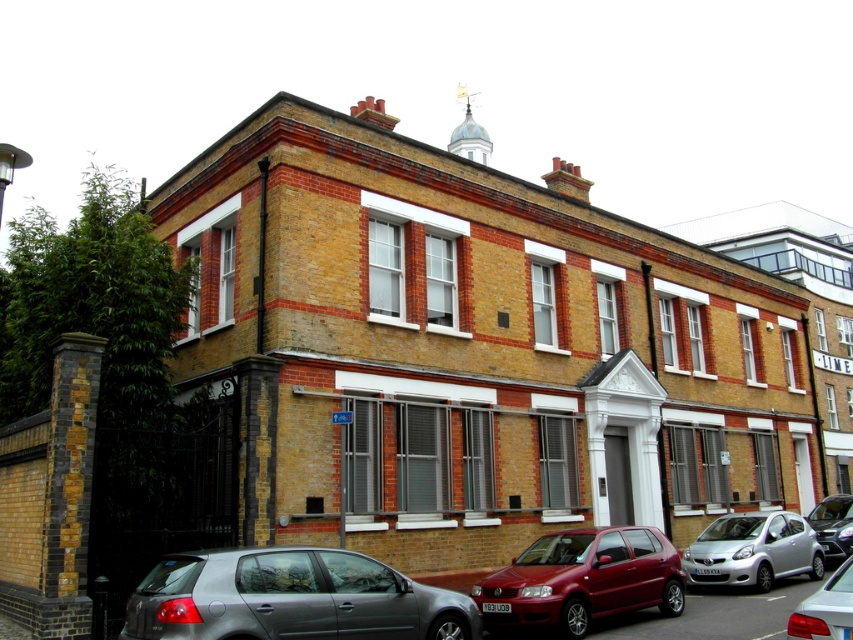
Between silver metallic hatchback at lower right and silver metallic sedan at center, which one has more height?

silver metallic sedan at center

Which is below, silver metallic hatchback at lower right or silver metallic sedan at center?

silver metallic hatchback at lower right is lower down.

Which is behind, point (785, 532) or point (846, 628)?

The point (785, 532) is more distant.

The image size is (853, 640). I want to click on silver metallic hatchback at lower right, so click(753, 550).

Does point (582, 540) come farther from viewer compared to point (844, 576)?

Yes, it is.

Is metallic red hatchback at center bigger than silver metallic sedan at center?

Incorrect, metallic red hatchback at center is not larger than silver metallic sedan at center.

From the picture: Who is more forward, (670, 611) or (813, 604)?

Point (813, 604)

Where is `metallic red hatchback at center`? The image size is (853, 640). metallic red hatchback at center is located at coordinates (582, 579).

What do you see at coordinates (582, 579) in the screenshot? I see `metallic red hatchback at center` at bounding box center [582, 579].

The image size is (853, 640). What are the coordinates of `metallic red hatchback at center` in the screenshot? It's located at (582, 579).